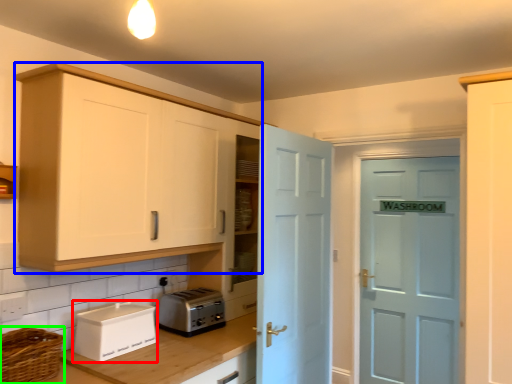
Question: Considering the real-world distances, which object is farthest from appliance (highlighted by a red box)? cabinetry (highlighted by a blue box) or basket (highlighted by a green box)?

Choices:
 (A) cabinetry
 (B) basket

Answer: (A)